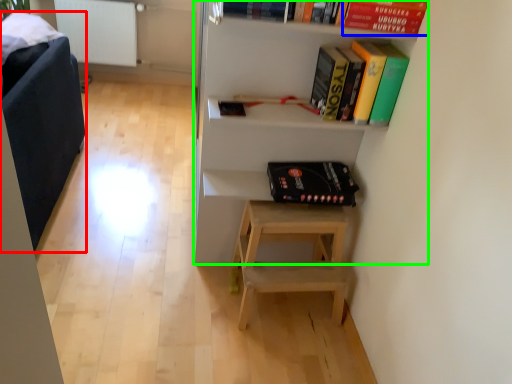
Question: Estimate the real-world distances between objects in this image. Which object is closer to armchair (highlighted by a red box), paperback book (highlighted by a blue box) or shelf (highlighted by a green box)?

Choices:
 (A) paperback book
 (B) shelf

Answer: (B)